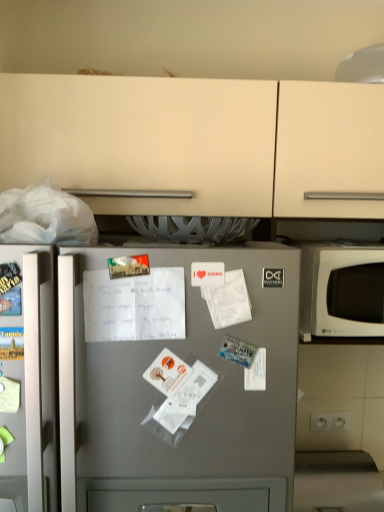
Find the location of `white matte microwave at right`. white matte microwave at right is located at coordinates (341, 290).

The width and height of the screenshot is (384, 512). Find the location of `satin silver fridge at center`. satin silver fridge at center is located at coordinates (178, 381).

Image resolution: width=384 pixels, height=512 pixels. I want to click on white matte microwave at right, so click(341, 290).

Based on the photo, considering the relative sizes of white paper receipt at center and white matte microwave at right in the image provided, is white paper receipt at center thinner than white matte microwave at right?

Correct, the width of white paper receipt at center is less than that of white matte microwave at right.

In the scene shown: Between white paper receipt at center and white matte microwave at right, which one has larger size?

With larger size is white matte microwave at right.

Is white paper receipt at center oriented towards white matte microwave at right?

No, white paper receipt at center does not turn towards white matte microwave at right.

Does satin silver fridge at center have a greater width compared to white matte microwave at right?

Yes.

Is satin silver fridge at center positioned in front of white matte microwave at right?

Yes, satin silver fridge at center is closer to the viewer.

From the picture: How different are the orientations of satin silver fridge at center and white matte microwave at right in degrees?

4.57 degrees separate the facing orientations of satin silver fridge at center and white matte microwave at right.

Would you say satin silver fridge at center is a long distance from white matte microwave at right?

No, there isn't a large distance between satin silver fridge at center and white matte microwave at right.

You are a GUI agent. You are given a task and a screenshot of the screen. Output one action in this format:
    pyautogui.click(x=<x>, y=<y>)
    Task: Click on the refrigerator below the white paper receipt at center (from a real-world perspective)
    The width and height of the screenshot is (384, 512).
    Given the screenshot: What is the action you would take?
    [178, 381]

From the image's perspective, is satin silver fridge at center under white paper receipt at center?

Yes, from the image's perspective, satin silver fridge at center is below white paper receipt at center.

Which of these two, satin silver fridge at center or white paper receipt at center, stands shorter?

white paper receipt at center.

Which object is positioned more to the left, satin silver fridge at center or white paper receipt at center?

satin silver fridge at center.

Which object is further away from the camera, white matte microwave at right or satin silver fridge at center?

Positioned behind is white matte microwave at right.

Which is more to the right, white matte microwave at right or satin silver fridge at center?

white matte microwave at right.

From the image's perspective, is white matte microwave at right over satin silver fridge at center?

Yes.

Between white matte microwave at right and satin silver fridge at center, which one has larger width?

satin silver fridge at center.

Which is more to the right, white paper receipt at center or satin silver fridge at center?

Positioned to the right is white paper receipt at center.

From the picture: Is white paper receipt at center spatially inside satin silver fridge at center, or outside of it?

white paper receipt at center lies within the bounds of satin silver fridge at center.

Is satin silver fridge at center at the back of white paper receipt at center?

Yes.

Based on the photo, would you consider white paper receipt at center to be distant from satin silver fridge at center?

white paper receipt at center is actually quite close to satin silver fridge at center.

Does white matte microwave at right have a larger size compared to white paper receipt at center?

Yes.

How much distance is there between white matte microwave at right and white paper receipt at center?

They are 27.53 inches apart.

From a real-world perspective, which object stands above the other?

white paper receipt at center, from a real-world perspective.

Considering the sizes of objects white matte microwave at right and white paper receipt at center in the image provided, who is thinner, white matte microwave at right or white paper receipt at center?

With smaller width is white paper receipt at center.

Where is `microwave oven on the right of white paper receipt at center`? The height and width of the screenshot is (512, 384). microwave oven on the right of white paper receipt at center is located at coordinates (341, 290).

Where is `microwave oven positioned vertically above the satin silver fridge at center (from a real-world perspective)`? Image resolution: width=384 pixels, height=512 pixels. microwave oven positioned vertically above the satin silver fridge at center (from a real-world perspective) is located at coordinates (341, 290).

Based on their spatial positions, is white paper receipt at center or white matte microwave at right further from satin silver fridge at center?

white matte microwave at right lies further to satin silver fridge at center than the other object.

From the image, which object appears to be farther from white matte microwave at right, white paper receipt at center or satin silver fridge at center?

Based on the image, white paper receipt at center appears to be further to white matte microwave at right.

When comparing their distances from white paper receipt at center, does satin silver fridge at center or white matte microwave at right seem further?

Among the two, white matte microwave at right is located further to white paper receipt at center.

Looking at the image, which one is located closer to satin silver fridge at center, white matte microwave at right or white paper receipt at center?

white paper receipt at center lies closer to satin silver fridge at center than the other object.

Estimate the real-world distances between objects in this image. Which object is further from white paper receipt at center, white matte microwave at right or satin silver fridge at center?

Based on the image, white matte microwave at right appears to be further to white paper receipt at center.

When comparing their distances from white matte microwave at right, does satin silver fridge at center or white paper receipt at center seem further?

white paper receipt at center lies further to white matte microwave at right than the other object.

Find the location of `receipt situated between satin silver fridge at center and white matte microwave at right from left to right`. receipt situated between satin silver fridge at center and white matte microwave at right from left to right is located at coordinates (134, 305).